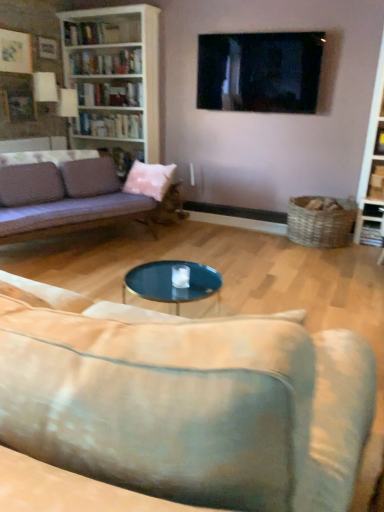
Question: Is pink fabric pillow at center positioned beyond the bounds of white glossy bookshelf at upper left?

Choices:
 (A) no
 (B) yes

Answer: (B)

Question: Considering the relative positions of pink fabric pillow at center and white glossy bookshelf at upper left in the image provided, is pink fabric pillow at center to the right of white glossy bookshelf at upper left from the viewer's perspective?

Choices:
 (A) yes
 (B) no

Answer: (A)

Question: Can you confirm if pink fabric pillow at center is thinner than white glossy bookshelf at upper left?

Choices:
 (A) no
 (B) yes

Answer: (A)

Question: Does pink fabric pillow at center lie behind white glossy bookshelf at upper left?

Choices:
 (A) yes
 (B) no

Answer: (B)

Question: Is pink fabric pillow at center facing away from white glossy bookshelf at upper left?

Choices:
 (A) no
 (B) yes

Answer: (A)

Question: Is pink fabric pillow at center in front of white glossy bookshelf at upper left?

Choices:
 (A) yes
 (B) no

Answer: (A)

Question: Are white glossy bookshelf at upper left and pink fabric pillow at center making contact?

Choices:
 (A) yes
 (B) no

Answer: (B)

Question: From the image's perspective, is white glossy bookshelf at upper left on top of pink fabric pillow at center?

Choices:
 (A) yes
 (B) no

Answer: (A)

Question: From a real-world perspective, does white glossy bookshelf at upper left sit lower than pink fabric pillow at center?

Choices:
 (A) no
 (B) yes

Answer: (A)

Question: From a real-world perspective, is white glossy bookshelf at upper left positioned over pink fabric pillow at center based on gravity?

Choices:
 (A) yes
 (B) no

Answer: (A)

Question: Is white glossy bookshelf at upper left wider than pink fabric pillow at center?

Choices:
 (A) yes
 (B) no

Answer: (B)

Question: Is white glossy bookshelf at upper left facing away from pink fabric pillow at center?

Choices:
 (A) no
 (B) yes

Answer: (A)

Question: Does black glossy tv at upper center have a lesser height compared to white wood bookcase at upper left?

Choices:
 (A) yes
 (B) no

Answer: (A)